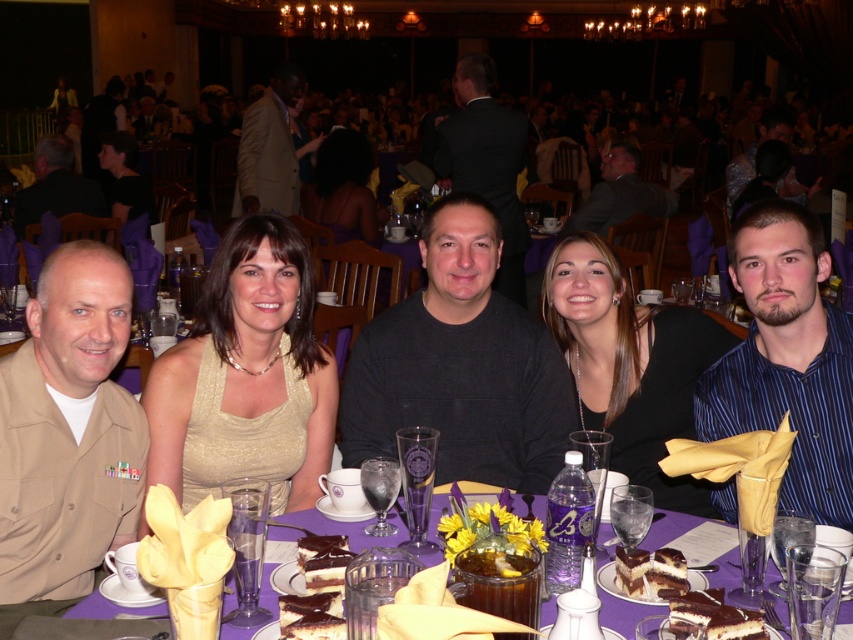
Looking at this image, you are standing in front of the banquet table and want to know how far the point at coordinates point (596, 330) is from you. Can you determine the distance?

The point (596, 330) is 7.61 feet away from you.

From the picture: You are a photographer at the event and want to capture a photo of the black silk dress at center and the shiny blue shirt at center. Which one is closer to the camera?

The black silk dress at center is positioned under the shiny blue shirt at center, so the shiny blue shirt at center is closer to the camera.

You are standing in front of the banquet table and want to reach both the point at position (x=25, y=209) and the point at position (x=674, y=557). Which point will you reach first if you move straight towards them?

The point at position (x=25, y=209) will be reached first because it is closer to you than the point at position (x=674, y=557).